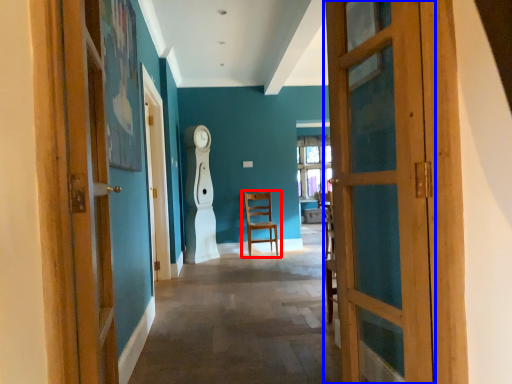
Question: Which object appears closest to the camera in this image, chair (highlighted by a red box) or door (highlighted by a blue box)?

Choices:
 (A) chair
 (B) door

Answer: (B)